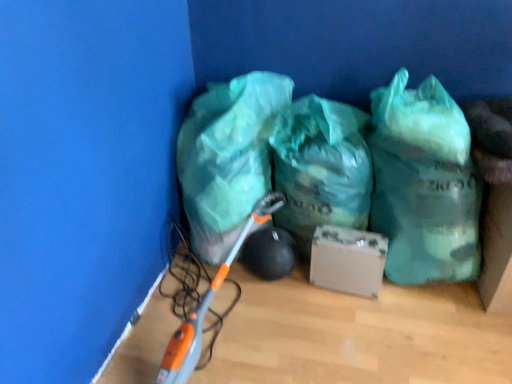
Question: Is translucent green plastic bag at lower left, arranged as the first plastic bag when viewed from the left, at the right side of green camouflage plastic bag at center, which is the third plastic bag from left to right?

Choices:
 (A) no
 (B) yes

Answer: (A)

Question: Is translucent green plastic bag at lower left, arranged as the first plastic bag when viewed from the left, positioned in front of green camouflage plastic bag at center, which is the third plastic bag from left to right?

Choices:
 (A) no
 (B) yes

Answer: (A)

Question: Is translucent green plastic bag at lower left, the 3th plastic bag from the right, looking in the opposite direction of green camouflage plastic bag at center, which is the third plastic bag from left to right?

Choices:
 (A) no
 (B) yes

Answer: (A)

Question: Would you say translucent green plastic bag at lower left, arranged as the first plastic bag when viewed from the left, is outside green camouflage plastic bag at center, which is the third plastic bag from left to right?

Choices:
 (A) no
 (B) yes

Answer: (B)

Question: From a real-world perspective, is translucent green plastic bag at lower left, arranged as the first plastic bag when viewed from the left, over green camouflage plastic bag at center, which is the third plastic bag from left to right?

Choices:
 (A) yes
 (B) no

Answer: (B)

Question: Considering their positions, is green camouflage plastic bag at center, which ranks as the 1th plastic bag in right-to-left order, located in front of or behind translucent green plastic bag at lower left, arranged as the first plastic bag when viewed from the left?

Choices:
 (A) front
 (B) behind

Answer: (A)

Question: Is point (452, 129) closer or farther from the camera than point (192, 170)?

Choices:
 (A) closer
 (B) farther

Answer: (A)

Question: Do you think green camouflage plastic bag at center, which is the third plastic bag from left to right, is within translucent green plastic bag at lower left, the 3th plastic bag from the right, or outside of it?

Choices:
 (A) inside
 (B) outside

Answer: (B)

Question: From a real-world perspective, is green camouflage plastic bag at center, which ranks as the 1th plastic bag in right-to-left order, physically located above or below translucent green plastic bag at lower left, arranged as the first plastic bag when viewed from the left?

Choices:
 (A) above
 (B) below

Answer: (A)

Question: Looking at their shapes, would you say translucent green plastic bag at lower left, arranged as the first plastic bag when viewed from the left, is wider or thinner than matte cardboard box at center?

Choices:
 (A) wide
 (B) thin

Answer: (A)

Question: From a real-world perspective, is translucent green plastic bag at lower left, arranged as the first plastic bag when viewed from the left, positioned above or below matte cardboard box at center?

Choices:
 (A) above
 (B) below

Answer: (A)

Question: Is translucent green plastic bag at lower left, the 3th plastic bag from the right, taller or shorter than matte cardboard box at center?

Choices:
 (A) tall
 (B) short

Answer: (A)

Question: Is translucent green plastic bag at lower left, arranged as the first plastic bag when viewed from the left, to the left or to the right of matte cardboard box at center in the image?

Choices:
 (A) right
 (B) left

Answer: (B)

Question: From a real-world perspective, is translucent green plastic bag at lower left, arranged as the first plastic bag when viewed from the left, physically located above or below green translucent plastic bag at center, the 2th plastic bag when ordered from left to right?

Choices:
 (A) above
 (B) below

Answer: (A)

Question: In terms of width, does translucent green plastic bag at lower left, arranged as the first plastic bag when viewed from the left, look wider or thinner when compared to green translucent plastic bag at center, the second plastic bag viewed from the right?

Choices:
 (A) wide
 (B) thin

Answer: (A)